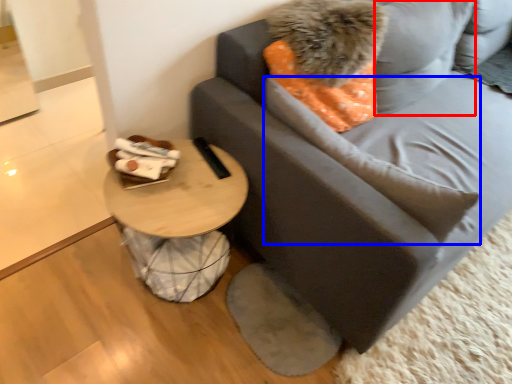
Question: Which object appears farthest to the camera in this image, pillow (highlighted by a red box) or pillow (highlighted by a blue box)?

Choices:
 (A) pillow
 (B) pillow

Answer: (A)